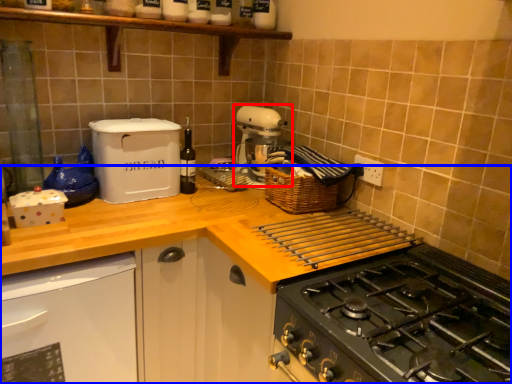
Question: Which point is closer to the camera, mixer (highlighted by a red box) or countertop (highlighted by a blue box)?

Choices:
 (A) mixer
 (B) countertop

Answer: (B)